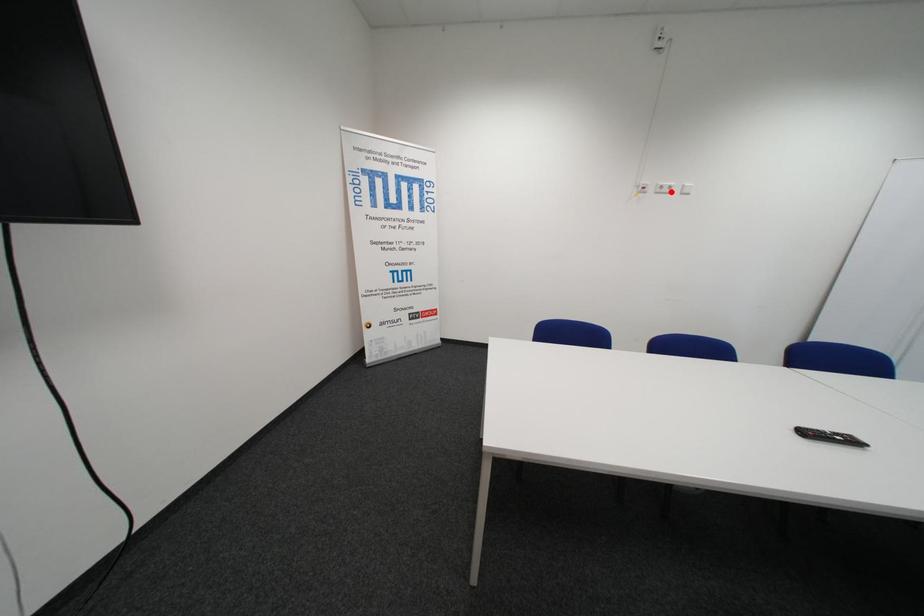
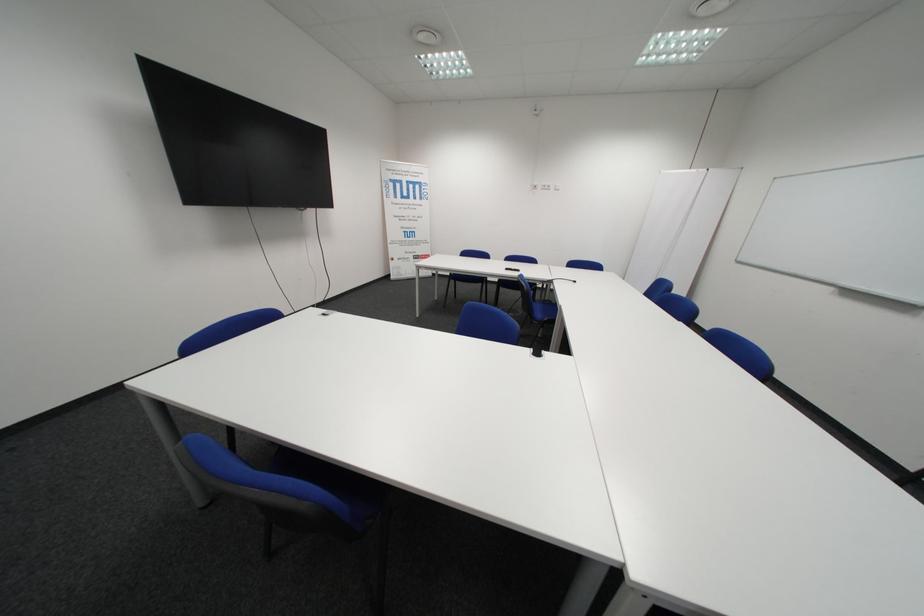
Locate, in the second image, the point that corresponds to the highlighted location in the first image.

(554, 188)